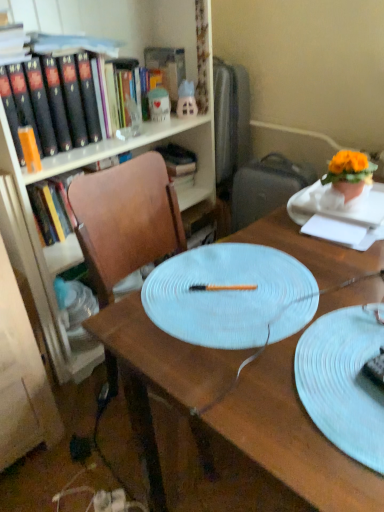
The height and width of the screenshot is (512, 384). Identify the location of free space that is to the left of orange matte flower pot at upper right. (306, 205).